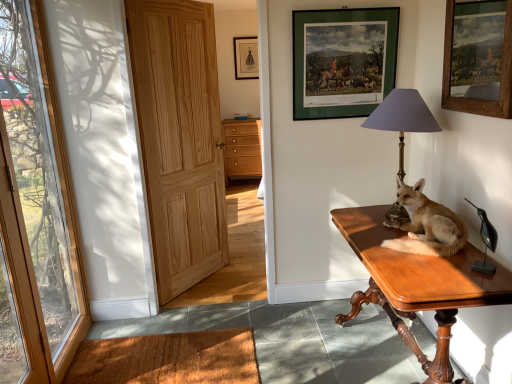
Question: Looking at their shapes, would you say wooden door at left, positioned as the second door in right-to-left order, is wider or thinner than brown coir mat at lower left?

Choices:
 (A) wide
 (B) thin

Answer: (B)

Question: From a real-world perspective, is wooden door at left, which ranks as the first door in left-to-right order, above or below brown coir mat at lower left?

Choices:
 (A) below
 (B) above

Answer: (B)

Question: Which object is the closest to the matte black dress at upper center, which is the third picture frame from front to back?

Choices:
 (A) green matte picture frame at upper center, arranged as the second picture frame when ordered from the bottom
 (B) brown shaggy carpet at lower left
 (C) brown fur stuffed fox at right
 (D) wooden-framed painting at upper right, marked as the 1th picture frame in a bottom-to-top arrangement
 (E) matte purple lampshade at center

Answer: (A)

Question: Based on their relative distances, which object is farther from the matte black dress at upper center, which is the third picture frame from front to back?

Choices:
 (A) brown fur stuffed fox at right
 (B) green matte picture frame at upper center, arranged as the second picture frame when ordered from the bottom
 (C) matte wood cabinet at center
 (D) wooden door at left, which ranks as the first door in left-to-right order
 (E) shiny brown wooden desk at right

Answer: (E)